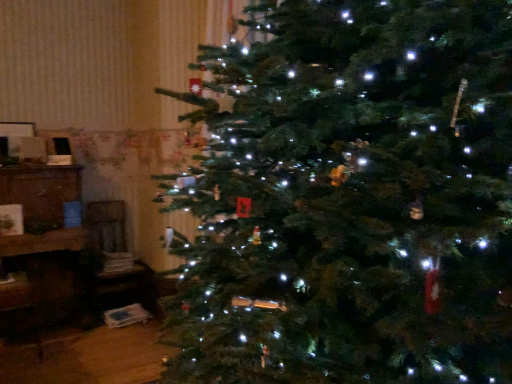
Question: Does green matte christmas tree at center come behind brown wooden cabinet at left?

Choices:
 (A) no
 (B) yes

Answer: (B)

Question: Does green matte christmas tree at center have a greater height compared to brown wooden cabinet at left?

Choices:
 (A) no
 (B) yes

Answer: (B)

Question: Could you tell me if green matte christmas tree at center is turned towards brown wooden cabinet at left?

Choices:
 (A) yes
 (B) no

Answer: (B)

Question: From a real-world perspective, is green matte christmas tree at center positioned over brown wooden cabinet at left based on gravity?

Choices:
 (A) no
 (B) yes

Answer: (B)

Question: Is green matte christmas tree at center far away from brown wooden cabinet at left?

Choices:
 (A) no
 (B) yes

Answer: (B)

Question: In the image, is green matte christmas tree at center on the left side or the right side of wooden chair at left?

Choices:
 (A) left
 (B) right

Answer: (B)

Question: From a real-world perspective, is green matte christmas tree at center positioned above or below wooden chair at left?

Choices:
 (A) above
 (B) below

Answer: (A)

Question: In the image, is green matte christmas tree at center positioned in front of or behind wooden chair at left?

Choices:
 (A) behind
 (B) front

Answer: (B)

Question: Is point (463, 145) positioned closer to the camera than point (105, 253)?

Choices:
 (A) farther
 (B) closer

Answer: (B)

Question: Do you think wooden chair at left is within brown wooden cabinet at left, or outside of it?

Choices:
 (A) inside
 (B) outside

Answer: (B)

Question: From a real-world perspective, is wooden chair at left positioned above or below brown wooden cabinet at left?

Choices:
 (A) below
 (B) above

Answer: (A)

Question: Is point (96, 307) positioned closer to the camera than point (41, 246)?

Choices:
 (A) closer
 (B) farther

Answer: (B)

Question: From the image's perspective, is wooden chair at left above or below brown wooden cabinet at left?

Choices:
 (A) below
 (B) above

Answer: (A)

Question: Relative to brown wooden cabinet at left, is green matte christmas tree at center in front or behind?

Choices:
 (A) behind
 (B) front

Answer: (A)

Question: From the image's perspective, is green matte christmas tree at center located above or below brown wooden cabinet at left?

Choices:
 (A) above
 (B) below

Answer: (A)